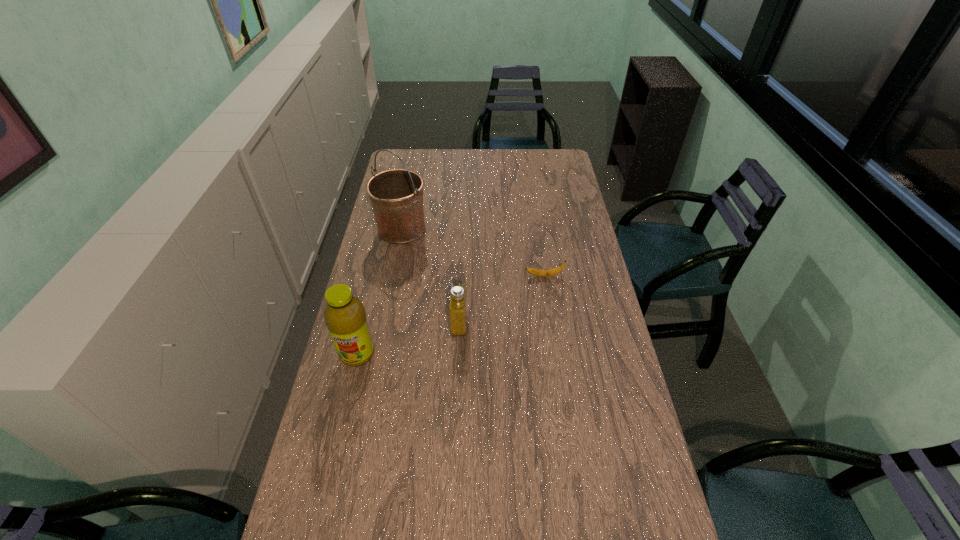
The image size is (960, 540). What are the coordinates of `vacant space situated 0.110m on the front-facing side of the second nearest object` in the screenshot? It's located at (499, 322).

In order to click on free space located on the peel of the rightmost object from the top in this screenshot , I will do `click(509, 276)`.

This screenshot has width=960, height=540. I want to click on free space located 0.270m on the peel of the rightmost object from the top, so click(x=453, y=276).

The height and width of the screenshot is (540, 960). Find the location of `vacant space positioned 0.200m on the peel of the rightmost object from the top`. vacant space positioned 0.200m on the peel of the rightmost object from the top is located at coordinates (471, 276).

What are the coordinates of `bucket located in the left edge section of the desktop` in the screenshot? It's located at (396, 195).

This screenshot has width=960, height=540. What are the coordinates of `fruit juice that is at the left edge` in the screenshot? It's located at (345, 316).

At what (x,y) coordinates should I click in order to perform the action: click on object present at the right edge. Please return your answer as a coordinate pair (x, y). Looking at the image, I should click on (538, 272).

The width and height of the screenshot is (960, 540). Find the location of `vacant area at the far edge of the desktop`. vacant area at the far edge of the desktop is located at coordinates (453, 149).

Identify the location of vacant region at the left edge. (402, 251).

Locate an element on the screen. free space at the right edge of the desktop is located at coordinates (585, 222).